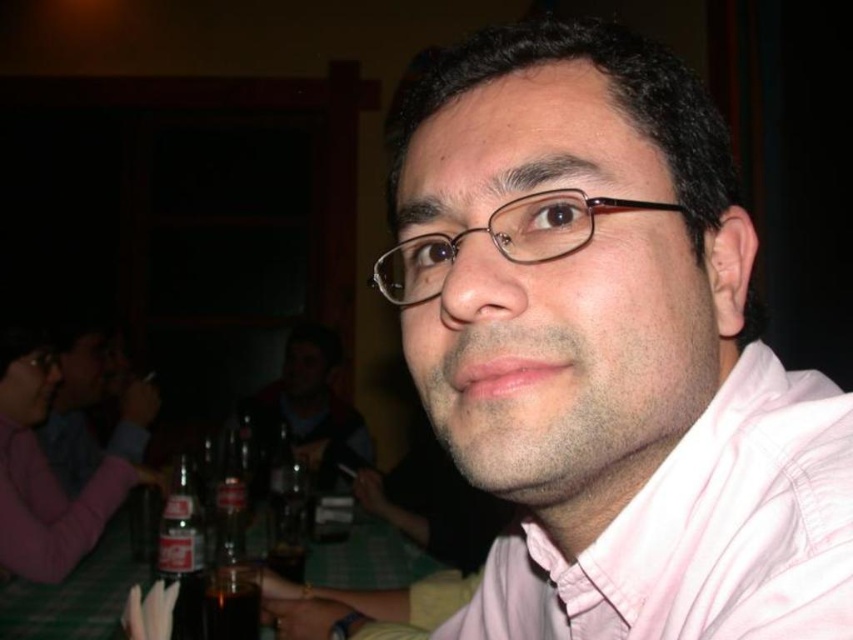
Is green fabric table at lower left shorter than matte black shirt at center?

Yes.

Can you confirm if green fabric table at lower left is wider than matte black shirt at center?

Yes.

This screenshot has width=853, height=640. In order to click on green fabric table at lower left in this screenshot , I will do `click(74, 595)`.

Can you confirm if brown shiny glasses at center is positioned to the left of matte glass bottle at lower left?

Incorrect, brown shiny glasses at center is not on the left side of matte glass bottle at lower left.

Can you confirm if brown shiny glasses at center is smaller than matte glass bottle at lower left?

Yes, brown shiny glasses at center is smaller than matte glass bottle at lower left.

Locate an element on the screen. The image size is (853, 640). brown shiny glasses at center is located at coordinates (500, 241).

What do you see at coordinates (701, 532) in the screenshot?
I see `pink cotton dress shirt at center` at bounding box center [701, 532].

Looking at this image, who is lower down, pink cotton dress shirt at center or green fabric table at lower left?

green fabric table at lower left

This screenshot has height=640, width=853. Describe the element at coordinates (701, 532) in the screenshot. I see `pink cotton dress shirt at center` at that location.

Locate an element on the screen. pink cotton dress shirt at center is located at coordinates (701, 532).